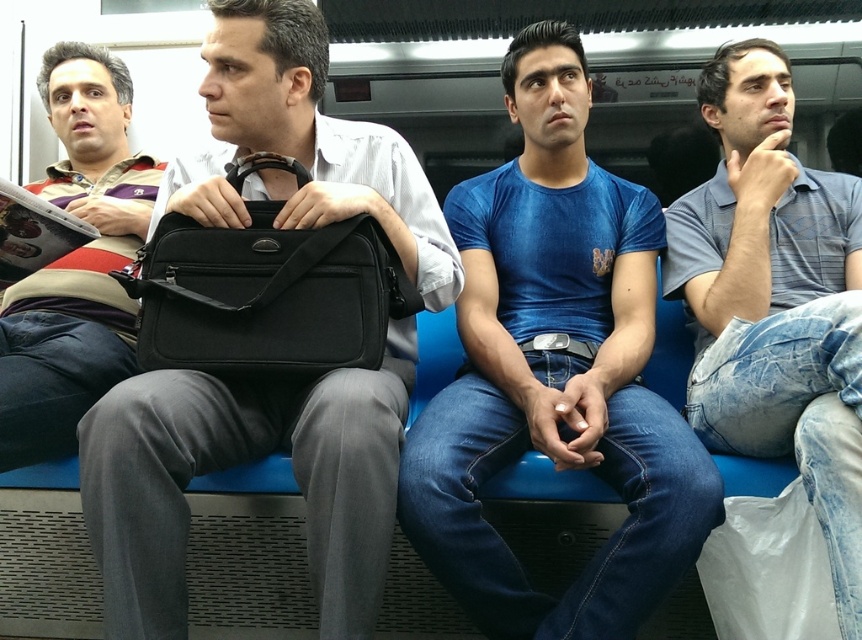
Question: Considering the real-world distances, which object is farthest from the blue denim jeans at center?

Choices:
 (A) striped sweater at left
 (B) black matte briefcase at center
 (C) gray striped polo shirt at center

Answer: (A)

Question: Which of these objects is positioned closest to the striped sweater at left?

Choices:
 (A) black matte briefcase at center
 (B) blue denim jeans at center
 (C) gray striped polo shirt at center

Answer: (A)

Question: Does blue denim jeans at center have a smaller size compared to striped sweater at left?

Choices:
 (A) no
 (B) yes

Answer: (A)

Question: Is black matte briefcase at center below black fabric briefcase at center?

Choices:
 (A) no
 (B) yes

Answer: (B)

Question: Which object is positioned closest to the gray striped polo shirt at center?

Choices:
 (A) blue denim jeans at center
 (B) black fabric briefcase at center
 (C) striped sweater at left

Answer: (A)

Question: Does black matte briefcase at center lie in front of black fabric briefcase at center?

Choices:
 (A) no
 (B) yes

Answer: (B)